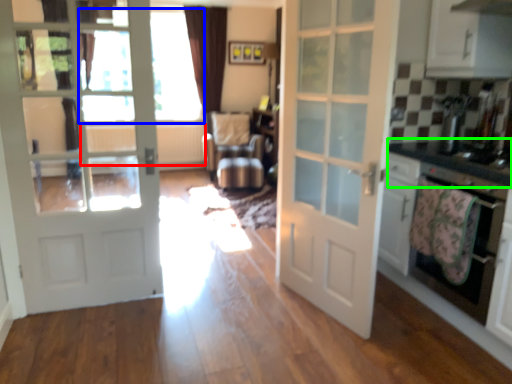
Question: Estimate the real-world distances between objects in this image. Which object is closer to radiator (highlighted by a red box), window screen (highlighted by a blue box) or counter top (highlighted by a green box)?

Choices:
 (A) window screen
 (B) counter top

Answer: (A)